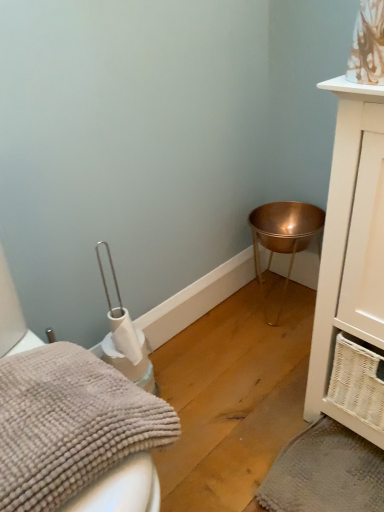
Question: From a real-world perspective, does gray textured bath towel at lower right, acting as the second bath towel starting from the front, sit lower than copper metallic bowl at lower right?

Choices:
 (A) no
 (B) yes

Answer: (B)

Question: Is gray textured bath towel at lower right, which is the 1th bath towel in bottom-to-top order, closer to the viewer compared to copper metallic bowl at lower right?

Choices:
 (A) no
 (B) yes

Answer: (B)

Question: Considering the relative sizes of gray textured bath towel at lower right, placed as the first bath towel when sorted from back to front, and copper metallic bowl at lower right in the image provided, is gray textured bath towel at lower right, placed as the first bath towel when sorted from back to front, smaller than copper metallic bowl at lower right?

Choices:
 (A) no
 (B) yes

Answer: (B)

Question: Can you confirm if gray textured bath towel at lower right, placed as the 2th bath towel when sorted from left to right, is shorter than copper metallic bowl at lower right?

Choices:
 (A) yes
 (B) no

Answer: (A)

Question: Does gray textured bath towel at lower right, placed as the 2th bath towel when sorted from left to right, turn towards copper metallic bowl at lower right?

Choices:
 (A) no
 (B) yes

Answer: (A)

Question: Does gray textured bath towel at lower right, which is the 1th bath towel in bottom-to-top order, have a lesser width compared to copper metallic bowl at lower right?

Choices:
 (A) no
 (B) yes

Answer: (A)

Question: Is copper metallic bowl at lower right oriented away from gray fluffy bath towel at lower left, the 2th bath towel from the right?

Choices:
 (A) yes
 (B) no

Answer: (B)

Question: Is the depth of copper metallic bowl at lower right less than that of gray fluffy bath towel at lower left, which is the 2th bath towel in bottom-to-top order?

Choices:
 (A) yes
 (B) no

Answer: (B)

Question: From the image's perspective, is copper metallic bowl at lower right located above gray fluffy bath towel at lower left, which is the second bath towel in back-to-front order?

Choices:
 (A) no
 (B) yes

Answer: (B)

Question: Is copper metallic bowl at lower right placed right next to gray fluffy bath towel at lower left, positioned as the first bath towel in front-to-back order?

Choices:
 (A) no
 (B) yes

Answer: (A)

Question: Does copper metallic bowl at lower right have a smaller size compared to gray fluffy bath towel at lower left, which is the second bath towel in back-to-front order?

Choices:
 (A) no
 (B) yes

Answer: (A)

Question: Can you confirm if copper metallic bowl at lower right is taller than gray fluffy bath towel at lower left, which is the second bath towel in back-to-front order?

Choices:
 (A) yes
 (B) no

Answer: (A)

Question: Is the depth of white wicker cabinet at right greater than that of gray textured bath towel at lower right, which is the second bath towel in top-to-bottom order?

Choices:
 (A) no
 (B) yes

Answer: (A)